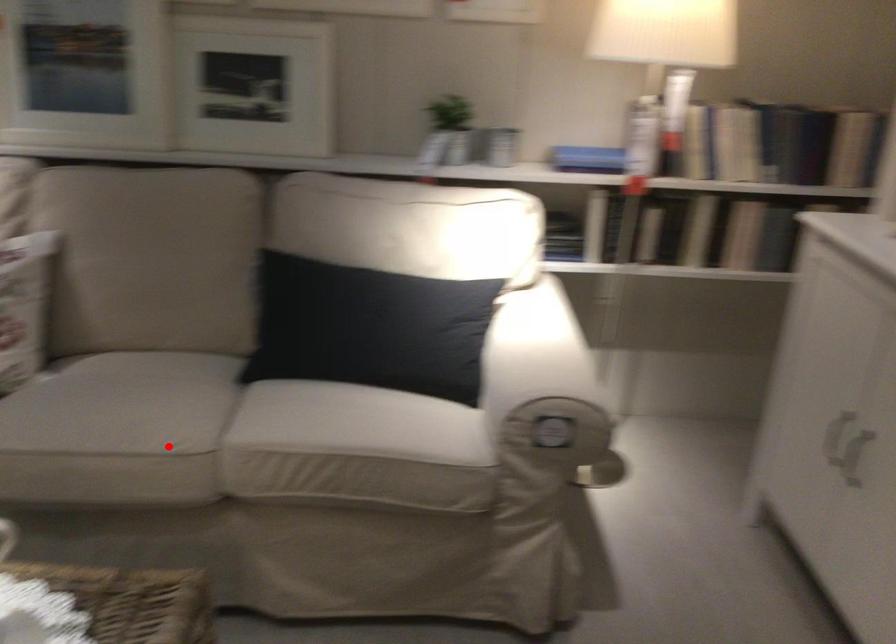
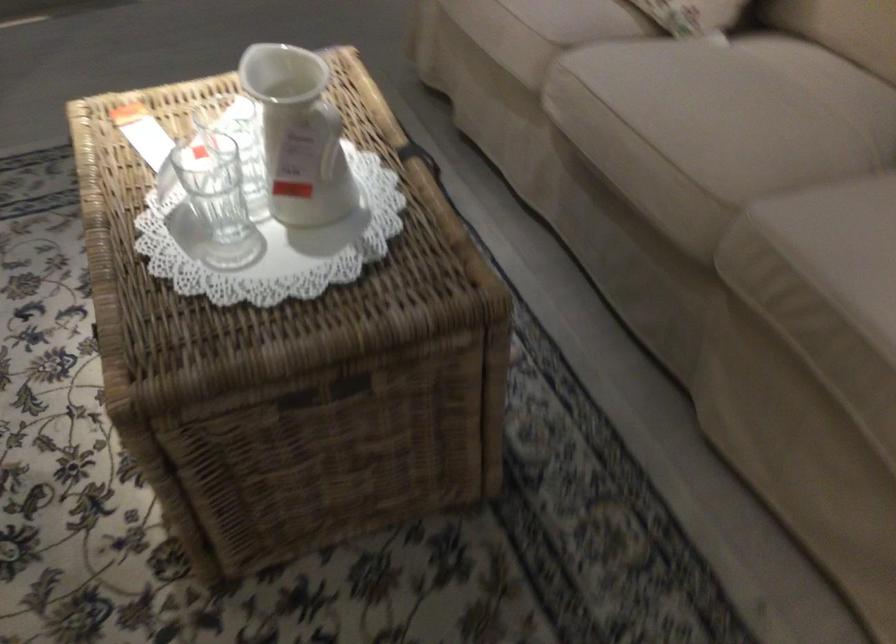
Find the pixel in the second image that matches the highlighted location in the first image.

(704, 167)